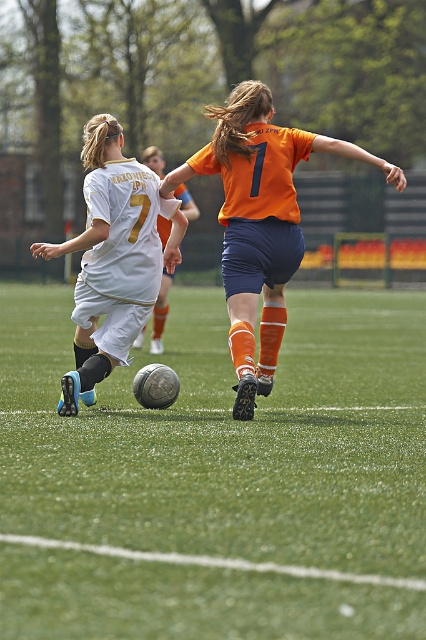
Between green grass football field at center and white matte jersey at center, which one has more height?

Standing taller between the two is green grass football field at center.

Can you confirm if green grass football field at center is smaller than white matte jersey at center?

No, green grass football field at center is not smaller than white matte jersey at center.

Is point (331, 394) positioned in front of point (164, 241)?

Yes, it is in front of point (164, 241).

Identify the location of green grass football field at center. The height and width of the screenshot is (640, 426). (227, 436).

Is orange matte jersey at center bigger than white matte jersey at center?

Yes.

Is orange matte jersey at center to the right of white matte jersey at center from the viewer's perspective?

Yes, orange matte jersey at center is to the right of white matte jersey at center.

Find the location of `orange matte jersey at center`. orange matte jersey at center is located at coordinates coord(259,221).

Looking at this image, does orange matte jersey at center have a larger size compared to white matte soccer ball at center?

Yes.

Which of these two, orange matte jersey at center or white matte soccer ball at center, stands shorter?

Standing shorter between the two is white matte soccer ball at center.

Is point (236, 161) closer to viewer compared to point (127, 266)?

That is False.

Locate an element on the screen. The width and height of the screenshot is (426, 640). orange matte jersey at center is located at coordinates (259, 221).